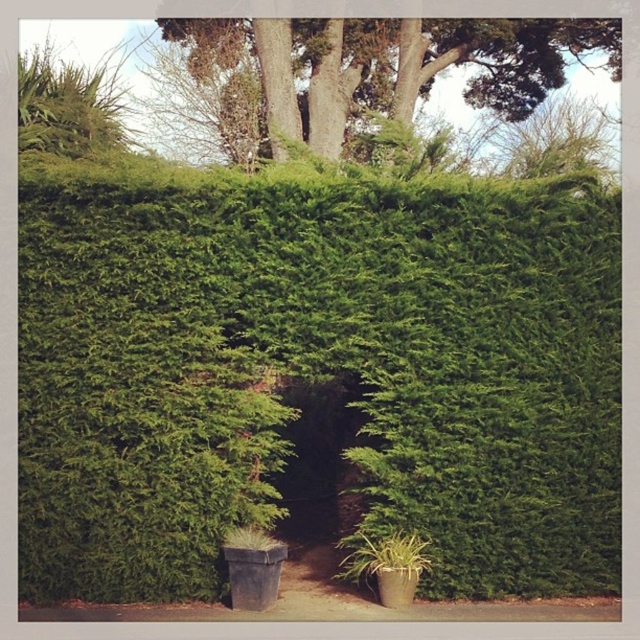
In the scene shown: Is green leafy hedge at center positioned in front of green leafy tree at upper center?

Yes, green leafy hedge at center is closer to the viewer.

Does green leafy hedge at center appear on the right side of green leafy tree at upper center?

Incorrect, green leafy hedge at center is not on the right side of green leafy tree at upper center.

Does point (323, 308) come farther from viewer compared to point (465, 54)?

No, it is in front of (465, 54).

In order to click on green leafy hedge at center in this screenshot , I will do `click(316, 372)`.